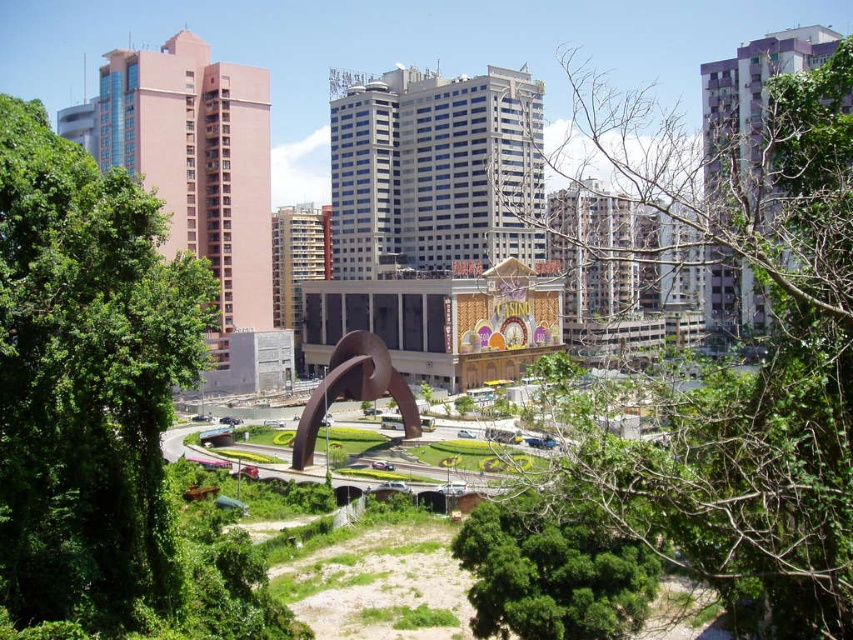
Does green leafy tree at left appear over green leafy tree at lower center?

Yes.

Can you confirm if green leafy tree at left is smaller than green leafy tree at lower center?

Actually, green leafy tree at left might be larger than green leafy tree at lower center.

Find the location of a particular element. The height and width of the screenshot is (640, 853). green leafy tree at left is located at coordinates (86, 380).

In the scene shown: Is green leafy tree at left to the left of brown polished metal sculpture at center from the viewer's perspective?

Yes, green leafy tree at left is to the left of brown polished metal sculpture at center.

Which is above, green leafy tree at left or brown polished metal sculpture at center?

green leafy tree at left is above.

Between point (100, 228) and point (347, 355), which one is positioned behind?

Point (347, 355)

Image resolution: width=853 pixels, height=640 pixels. Find the location of `green leafy tree at left`. green leafy tree at left is located at coordinates (86, 380).

Is green leafy tree at center shorter than green leafy tree at lower center?

No.

Is green leafy tree at center bigger than green leafy tree at lower center?

Yes, green leafy tree at center is bigger than green leafy tree at lower center.

Is point (589, 108) positioned behind point (531, 608)?

Yes, it is.

Where is `green leafy tree at center`? green leafy tree at center is located at coordinates (706, 397).